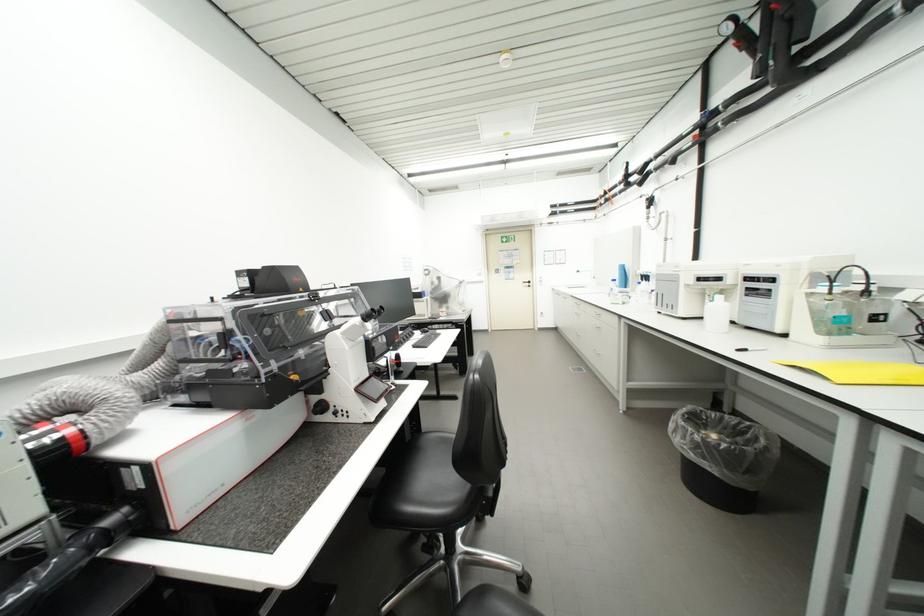
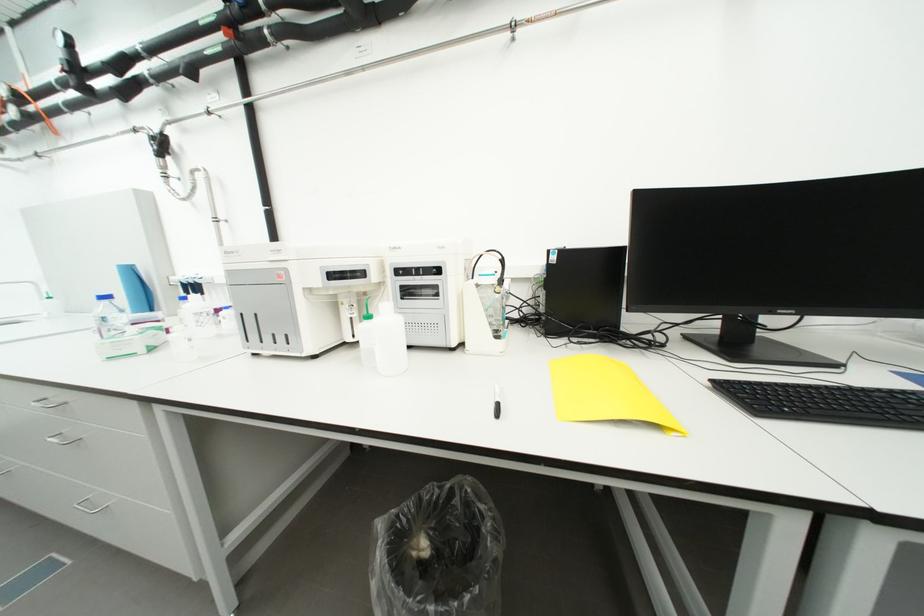
In the second image, find the point that corresponds to (x=758, y=429) in the first image.

(459, 493)